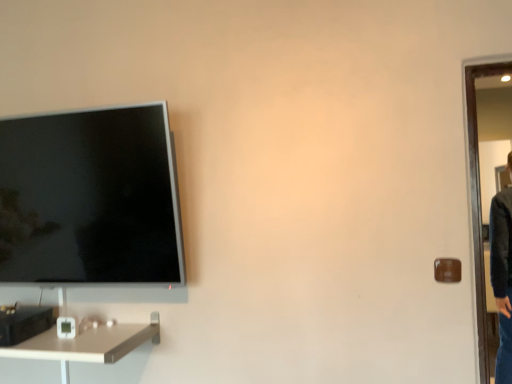
What do you see at coordinates (447, 270) in the screenshot?
I see `brown matte door handle at right` at bounding box center [447, 270].

This screenshot has height=384, width=512. I want to click on brown matte door handle at right, so click(447, 270).

This screenshot has width=512, height=384. Find the location of `white glossy desk at lower left`. white glossy desk at lower left is located at coordinates (86, 344).

This screenshot has width=512, height=384. Describe the element at coordinates (86, 344) in the screenshot. I see `white glossy desk at lower left` at that location.

Locate an element on the screen. brown matte door handle at right is located at coordinates (447, 270).

Considering the relative positions of white glossy desk at lower left and brown matte door handle at right in the image provided, is white glossy desk at lower left to the right of brown matte door handle at right from the viewer's perspective?

No.

Between white glossy desk at lower left and brown matte door handle at right, which one is positioned in front?

white glossy desk at lower left.

Is point (60, 346) farther from viewer compared to point (437, 274)?

Yes.

From the image's perspective, is white glossy desk at lower left located above brown matte door handle at right?

Incorrect, from the image's perspective, white glossy desk at lower left is lower than brown matte door handle at right.

From a real-world perspective, which is physically above, white glossy desk at lower left or brown matte door handle at right?

brown matte door handle at right, from a real-world perspective.

Does white glossy desk at lower left have a lesser width compared to brown matte door handle at right?

No, white glossy desk at lower left is not thinner than brown matte door handle at right.

In terms of height, does white glossy desk at lower left look taller or shorter compared to brown matte door handle at right?

Clearly, white glossy desk at lower left is shorter compared to brown matte door handle at right.

Looking at this image, can you confirm if white glossy desk at lower left is smaller than brown matte door handle at right?

No.

Looking at this image, is white glossy desk at lower left not within brown matte door handle at right?

white glossy desk at lower left is positioned outside brown matte door handle at right.

Are white glossy desk at lower left and brown matte door handle at right beside each other?

No, white glossy desk at lower left is not touching brown matte door handle at right.

Does white glossy desk at lower left turn towards brown matte door handle at right?

No, white glossy desk at lower left does not turn towards brown matte door handle at right.

How different are the orientations of white glossy desk at lower left and brown matte door handle at right in degrees?

The facing directions of white glossy desk at lower left and brown matte door handle at right are 0.512 degrees apart.

The width and height of the screenshot is (512, 384). What are the coordinates of `desk that appears on the left of brown matte door handle at right` in the screenshot? It's located at (86, 344).

Considering the relative positions of brown matte door handle at right and white glossy desk at lower left in the image provided, is brown matte door handle at right to the left of white glossy desk at lower left from the viewer's perspective?

Incorrect, brown matte door handle at right is not on the left side of white glossy desk at lower left.

Considering the positions of objects brown matte door handle at right and white glossy desk at lower left in the image provided, who is behind, brown matte door handle at right or white glossy desk at lower left?

Positioned behind is brown matte door handle at right.

Which is closer to the camera, (441, 276) or (37, 341)?

Point (441, 276).

Looking at this image, from the image's perspective, is brown matte door handle at right positioned above or below white glossy desk at lower left?

brown matte door handle at right is above white glossy desk at lower left.

From a real-world perspective, which is physically below, brown matte door handle at right or white glossy desk at lower left?

white glossy desk at lower left is physically lower.

Based on the photo, which object is thinner, brown matte door handle at right or white glossy desk at lower left?

With smaller width is brown matte door handle at right.

Between brown matte door handle at right and white glossy desk at lower left, which one has more height?

brown matte door handle at right is taller.

Considering the relative sizes of brown matte door handle at right and white glossy desk at lower left in the image provided, is brown matte door handle at right smaller than white glossy desk at lower left?

Yes, brown matte door handle at right is smaller than white glossy desk at lower left.

Would you say brown matte door handle at right is outside white glossy desk at lower left?

Yes, brown matte door handle at right is not within white glossy desk at lower left.

Is brown matte door handle at right not near white glossy desk at lower left?

Absolutely, brown matte door handle at right is distant from white glossy desk at lower left.

Could you tell me if brown matte door handle at right is turned towards white glossy desk at lower left?

No, brown matte door handle at right is not turned towards white glossy desk at lower left.

Identify the location of desk in front of the brown matte door handle at right. (86, 344).

Where is `desk that appears below the brown matte door handle at right (from a real-world perspective)`? The image size is (512, 384). desk that appears below the brown matte door handle at right (from a real-world perspective) is located at coordinates (86, 344).

In order to click on door handle located behind the white glossy desk at lower left in this screenshot , I will do `click(447, 270)`.